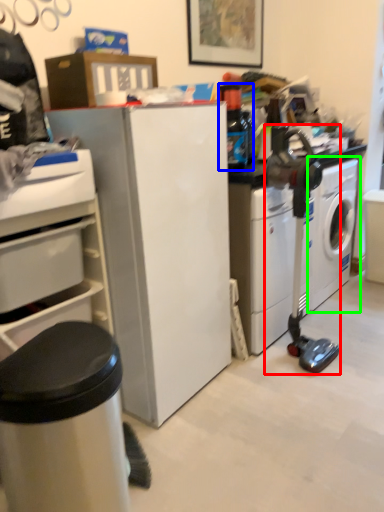
Question: Estimate the real-world distances between objects in this image. Which object is closer to sewing machine (highlighted by a red box), bottle (highlighted by a blue box) or washing machine (highlighted by a green box)?

Choices:
 (A) bottle
 (B) washing machine

Answer: (B)